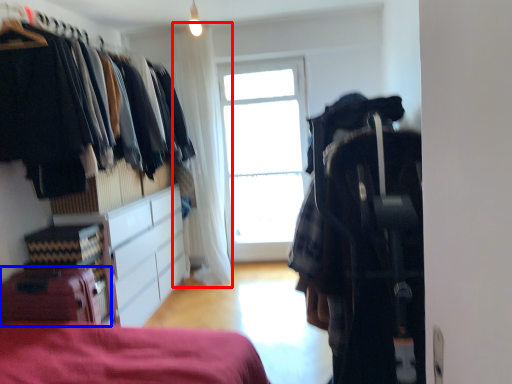
Question: Which point is closer to the camera, curtain (highlighted by a red box) or luggage (highlighted by a blue box)?

Choices:
 (A) curtain
 (B) luggage

Answer: (B)